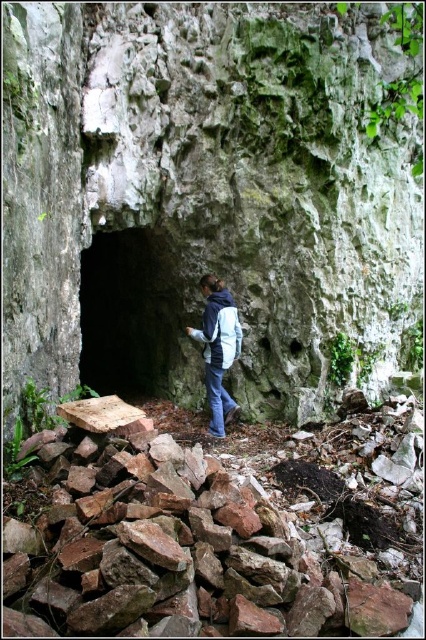
Is dark stone cave at center positioned behind blue fleece jacket at center?

That is True.

Who is more distant from viewer, (146, 390) or (224, 353)?

The point (146, 390) is more distant.

At what (x,y) coordinates should I click in order to perform the action: click on dark stone cave at center. Please return your answer as a coordinate pair (x, y). The height and width of the screenshot is (640, 426). Looking at the image, I should click on (132, 314).

Between rusty stone rubble at lower center and blue fleece jacket at center, which one has more height?

Standing taller between the two is blue fleece jacket at center.

Is rusty stone rubble at lower center wider than blue fleece jacket at center?

Yes, rusty stone rubble at lower center is wider than blue fleece jacket at center.

Is point (368, 611) behind point (213, 292)?

No, (368, 611) is in front of (213, 292).

Where is `rusty stone rubble at lower center`? The height and width of the screenshot is (640, 426). rusty stone rubble at lower center is located at coordinates (221, 532).

Is rusty stone rubble at lower center above blue denim jeans at center?

No, rusty stone rubble at lower center is not above blue denim jeans at center.

Consider the image. Does rusty stone rubble at lower center have a larger size compared to blue denim jeans at center?

Correct, rusty stone rubble at lower center is larger in size than blue denim jeans at center.

Which is in front, point (154, 493) or point (212, 388)?

Point (154, 493)

Locate an element on the screen. Image resolution: width=426 pixels, height=640 pixels. rusty stone rubble at lower center is located at coordinates (221, 532).